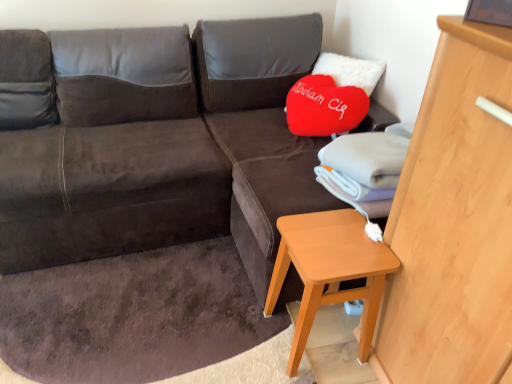
Question: From the image's perspective, is dark brown fabric couch at center located above or below light wood dresser at right?

Choices:
 (A) above
 (B) below

Answer: (A)

Question: Considering the positions of point (53, 183) and point (485, 309), is point (53, 183) closer or farther from the camera than point (485, 309)?

Choices:
 (A) farther
 (B) closer

Answer: (A)

Question: Which object is the closest to the suede-like brown bean bag at left?

Choices:
 (A) orange wood side table at lower right
 (B) dark brown fabric couch at center
 (C) light wood dresser at right

Answer: (B)

Question: Which object is positioned closest to the suede-like brown bean bag at left?

Choices:
 (A) orange wood side table at lower right
 (B) dark brown fabric couch at center
 (C) light wood dresser at right

Answer: (B)